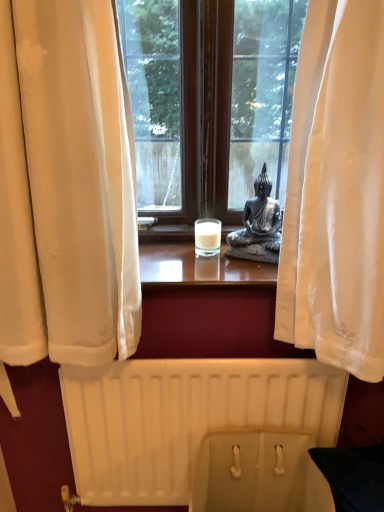
Image resolution: width=384 pixels, height=512 pixels. In order to click on vacant space to the left of satin black statue at center in this screenshot , I will do `click(189, 262)`.